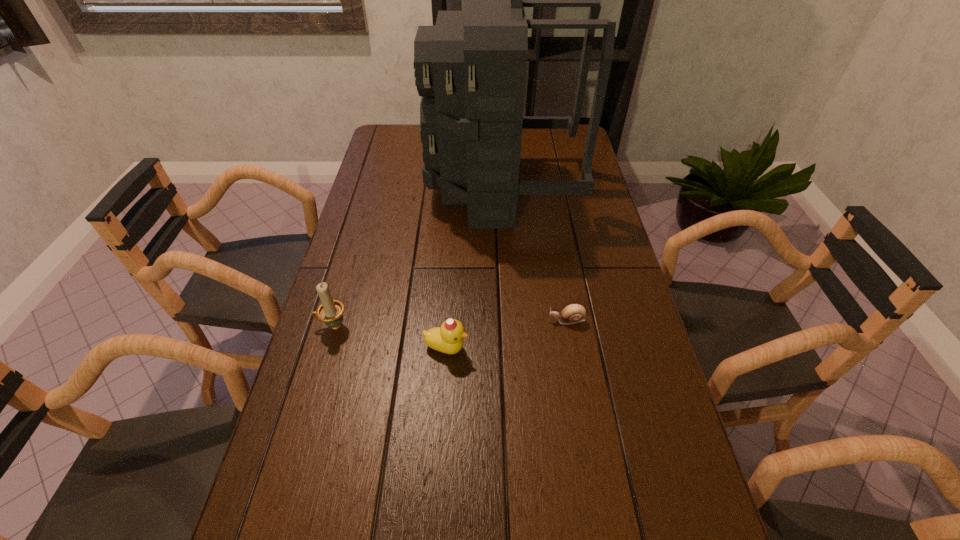
The width and height of the screenshot is (960, 540). Identify the location of the tallest object. (470, 68).

Where is `the farthest object`? The image size is (960, 540). the farthest object is located at coordinates (470, 68).

Image resolution: width=960 pixels, height=540 pixels. I want to click on candle_holder, so click(331, 311).

Where is `the leftmost object`? The height and width of the screenshot is (540, 960). the leftmost object is located at coordinates (331, 311).

Where is `the third tallest object`? the third tallest object is located at coordinates tap(448, 338).

Find the location of `escargot`. escargot is located at coordinates (574, 313).

At what (x,y) coordinates should I click in order to perform the action: click on free spot located 0.150m on the front compartment of the tallest object. Please return your answer as a coordinate pair (x, y). This screenshot has width=960, height=540. Looking at the image, I should click on [384, 189].

Where is `vacant space situated on the front compartment of the tallest object`? The height and width of the screenshot is (540, 960). vacant space situated on the front compartment of the tallest object is located at coordinates (381, 189).

This screenshot has width=960, height=540. I want to click on vacant space located on the front compartment of the tallest object, so click(408, 189).

Identify the location of free region located on the front-facing side of the duckling. (612, 348).